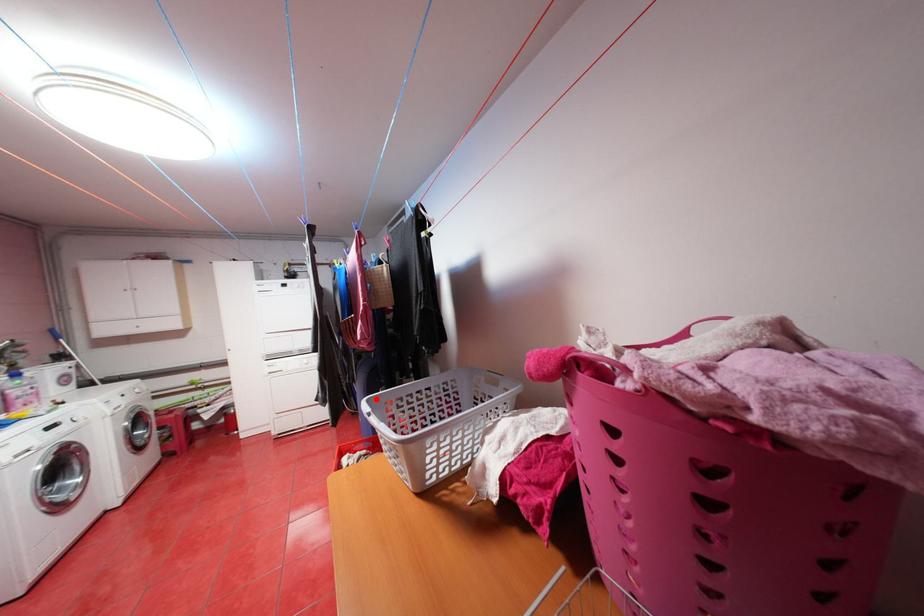
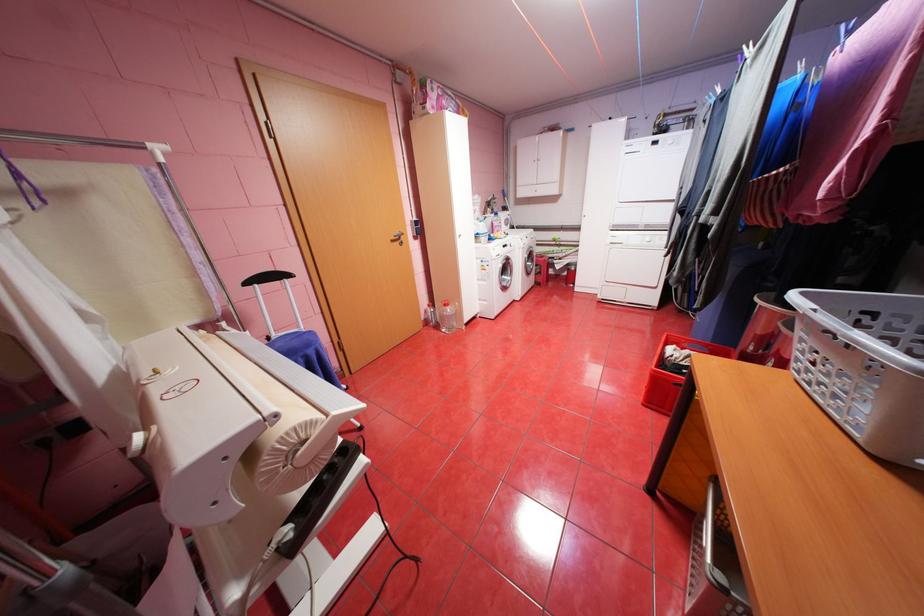
Question: I am providing you with two images of the same scene from different viewpoints. Image1 has a red point marked. In image2, the corresponding 3D location appears at what relative position? Reply with the corresponding letter.

Choices:
 (A) Closer
 (B) Farther

Answer: (B)